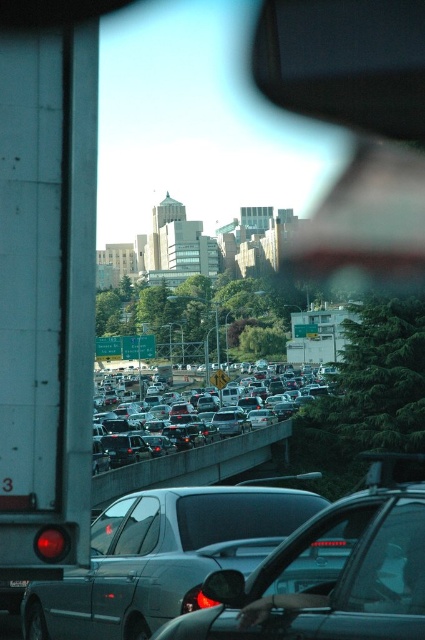
Question: Does glossy plastic rearview mirror at upper right appear on the right side of silver metallic sedan at center?

Choices:
 (A) yes
 (B) no

Answer: (A)

Question: Which of the following is the closest to the observer?

Choices:
 (A) white matte trailer truck at left
 (B) black plastic rearview mirror at upper right

Answer: (A)

Question: Which object appears closest to the camera in this image?

Choices:
 (A) white matte trailer truck at left
 (B) glossy plastic rearview mirror at upper right
 (C) silver metallic sedan at center

Answer: (A)

Question: Which object is positioned closest to the silver metallic sedan at center?

Choices:
 (A) black plastic rearview mirror at upper right
 (B) white matte trailer truck at left

Answer: (B)

Question: Does glossy plastic rearview mirror at upper right appear on the left side of silver metallic sedan at center?

Choices:
 (A) no
 (B) yes

Answer: (A)

Question: Is silver metallic sedan at center wider than black plastic license plate at center?

Choices:
 (A) yes
 (B) no

Answer: (A)